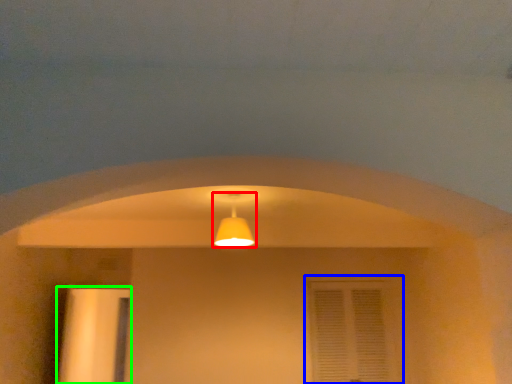
Question: Considering the real-world distances, which object is closest to lamp (highlighted by a red box)? window (highlighted by a blue box) or door (highlighted by a green box).

Choices:
 (A) window
 (B) door

Answer: (A)